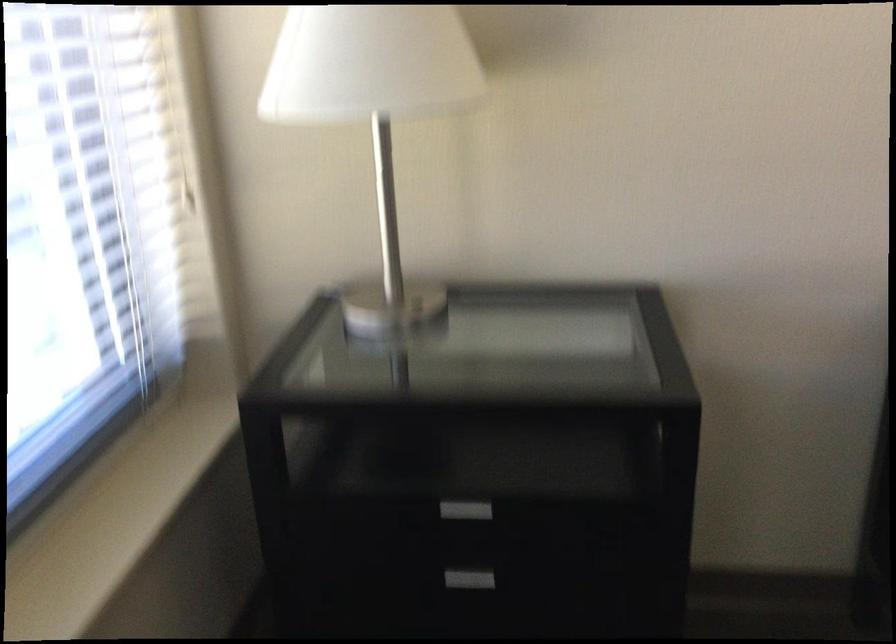
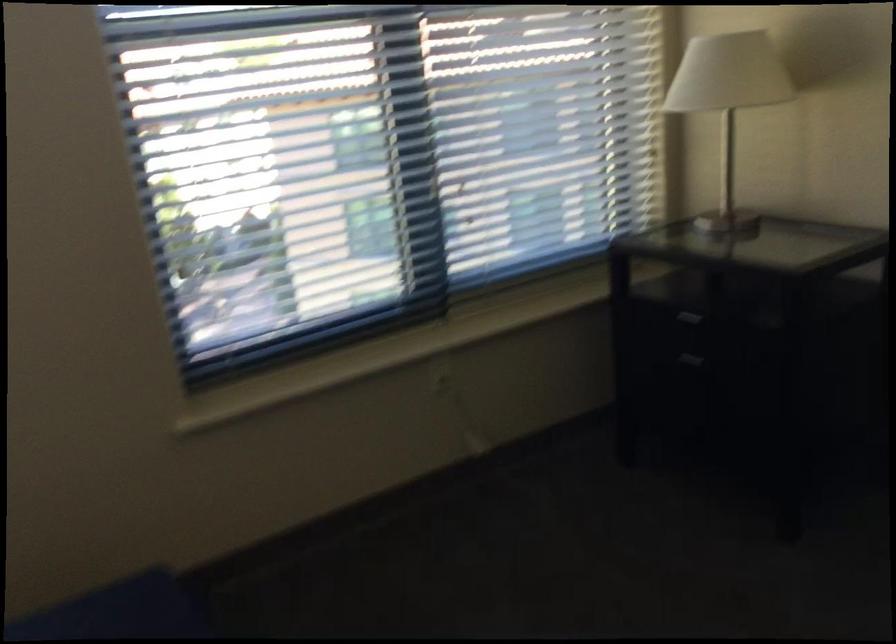
The point at (438,488) is marked in the first image. Where is the corresponding point in the second image?

(682, 330)